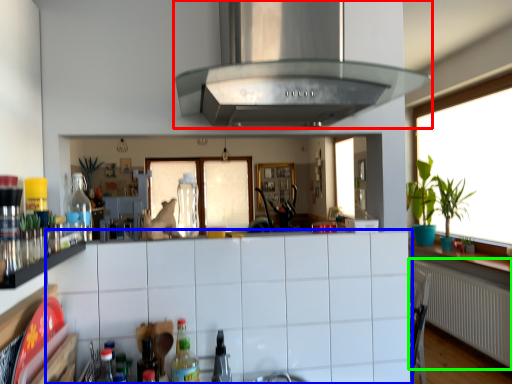
Question: Estimate the real-world distances between objects in this image. Which object is farther from exhaust hood (highlighted by a red box), cabinetry (highlighted by a blue box) or radiator (highlighted by a green box)?

Choices:
 (A) cabinetry
 (B) radiator

Answer: (B)